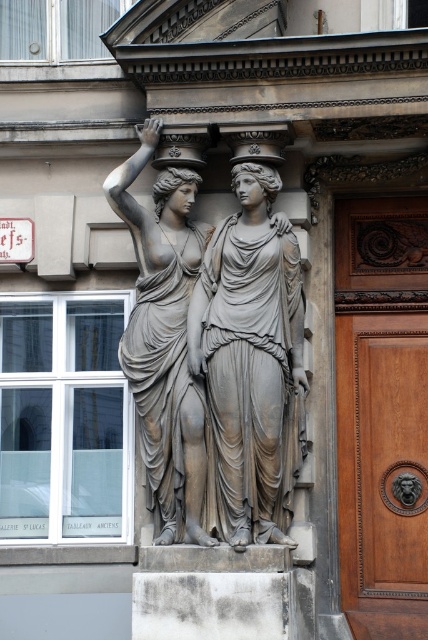
You are standing in front of the brown polished wood door at right and the bronze statue at center. Which object is closer to you?

The brown polished wood door at right is closer to you because it is further to the viewer than the bronze statue at center.